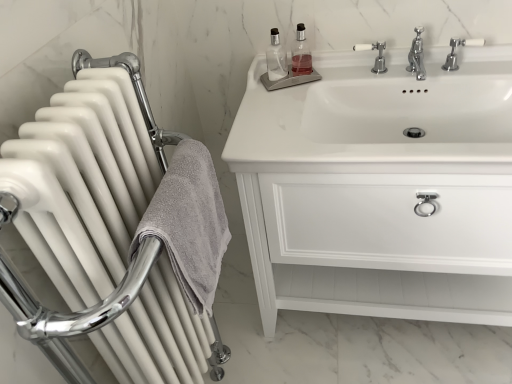
Identify the location of free spot in front of clear glass bottle at upper center. (261, 112).